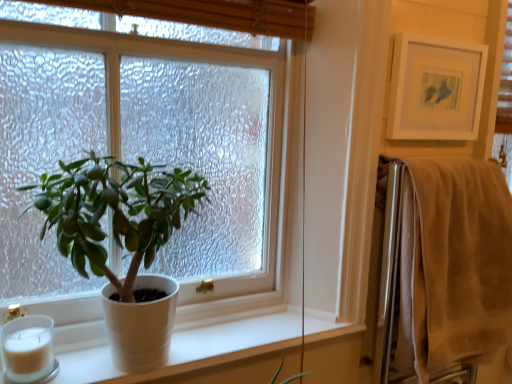
Question: Can you confirm if white matte candle at lower left is smaller than beige cotton towel at right?

Choices:
 (A) no
 (B) yes

Answer: (B)

Question: Considering the relative sizes of white matte candle at lower left and beige cotton towel at right in the image provided, is white matte candle at lower left thinner than beige cotton towel at right?

Choices:
 (A) no
 (B) yes

Answer: (B)

Question: Is beige cotton towel at right completely or partially inside white matte candle at lower left?

Choices:
 (A) no
 (B) yes

Answer: (A)

Question: Are white matte candle at lower left and beige cotton towel at right located far from each other?

Choices:
 (A) no
 (B) yes

Answer: (B)

Question: Considering the relative sizes of white matte candle at lower left and beige cotton towel at right in the image provided, is white matte candle at lower left wider than beige cotton towel at right?

Choices:
 (A) yes
 (B) no

Answer: (B)

Question: Is point (70, 170) positioned closer to the camera than point (410, 72)?

Choices:
 (A) closer
 (B) farther

Answer: (A)

Question: Is white matte pot at left to the left or to the right of white matte picture frame at upper right in the image?

Choices:
 (A) right
 (B) left

Answer: (B)

Question: Is white matte pot at left inside or outside of white matte picture frame at upper right?

Choices:
 (A) outside
 (B) inside

Answer: (A)

Question: From their relative heights in the image, would you say white matte pot at left is taller or shorter than white matte picture frame at upper right?

Choices:
 (A) tall
 (B) short

Answer: (A)

Question: In the image, is white matte picture frame at upper right positioned in front of or behind white matte pot at left?

Choices:
 (A) front
 (B) behind

Answer: (B)

Question: Considering the positions of white matte picture frame at upper right and white matte pot at left in the image, is white matte picture frame at upper right taller or shorter than white matte pot at left?

Choices:
 (A) short
 (B) tall

Answer: (A)

Question: From the image's perspective, relative to white matte pot at left, is white matte picture frame at upper right above or below?

Choices:
 (A) below
 (B) above

Answer: (B)

Question: Looking at their shapes, would you say white matte picture frame at upper right is wider or thinner than white matte pot at left?

Choices:
 (A) thin
 (B) wide

Answer: (A)

Question: From a real-world perspective, is white matte candle at lower left physically located above or below white matte picture frame at upper right?

Choices:
 (A) above
 (B) below

Answer: (B)

Question: From their relative heights in the image, would you say white matte candle at lower left is taller or shorter than white matte picture frame at upper right?

Choices:
 (A) short
 (B) tall

Answer: (A)